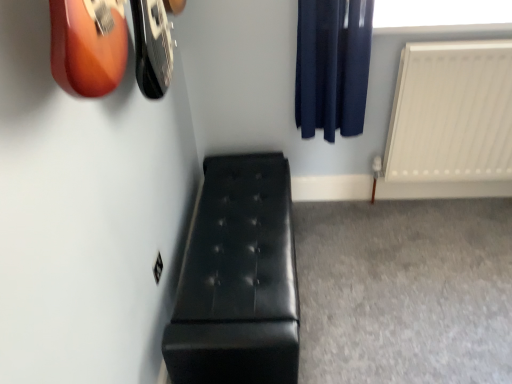
Question: Is white matte radiator at right positioned with its back to transparent plastic window screen at upper right?

Choices:
 (A) no
 (B) yes

Answer: (A)

Question: From a real-world perspective, is white matte radiator at right over transparent plastic window screen at upper right?

Choices:
 (A) yes
 (B) no

Answer: (B)

Question: Does white matte radiator at right have a greater height compared to transparent plastic window screen at upper right?

Choices:
 (A) yes
 (B) no

Answer: (A)

Question: From a real-world perspective, is white matte radiator at right beneath transparent plastic window screen at upper right?

Choices:
 (A) no
 (B) yes

Answer: (B)

Question: Does white matte radiator at right lie in front of transparent plastic window screen at upper right?

Choices:
 (A) no
 (B) yes

Answer: (B)

Question: Is transparent plastic window screen at upper right completely or partially inside white matte radiator at right?

Choices:
 (A) yes
 (B) no

Answer: (B)

Question: Is transparent plastic window screen at upper right at the left side of white matte radiator at right?

Choices:
 (A) yes
 (B) no

Answer: (A)

Question: From the image's perspective, is transparent plastic window screen at upper right below white matte radiator at right?

Choices:
 (A) yes
 (B) no

Answer: (B)

Question: Is transparent plastic window screen at upper right positioned far away from white matte radiator at right?

Choices:
 (A) yes
 (B) no

Answer: (B)

Question: Is transparent plastic window screen at upper right positioned beyond the bounds of white matte radiator at right?

Choices:
 (A) no
 (B) yes

Answer: (B)

Question: Does transparent plastic window screen at upper right have a smaller size compared to white matte radiator at right?

Choices:
 (A) no
 (B) yes

Answer: (B)

Question: Considering the relative sizes of transparent plastic window screen at upper right and white matte radiator at right in the image provided, is transparent plastic window screen at upper right taller than white matte radiator at right?

Choices:
 (A) yes
 (B) no

Answer: (B)

Question: Is white matte radiator at right smaller than dark blue fabric curtain at upper right?

Choices:
 (A) no
 (B) yes

Answer: (A)